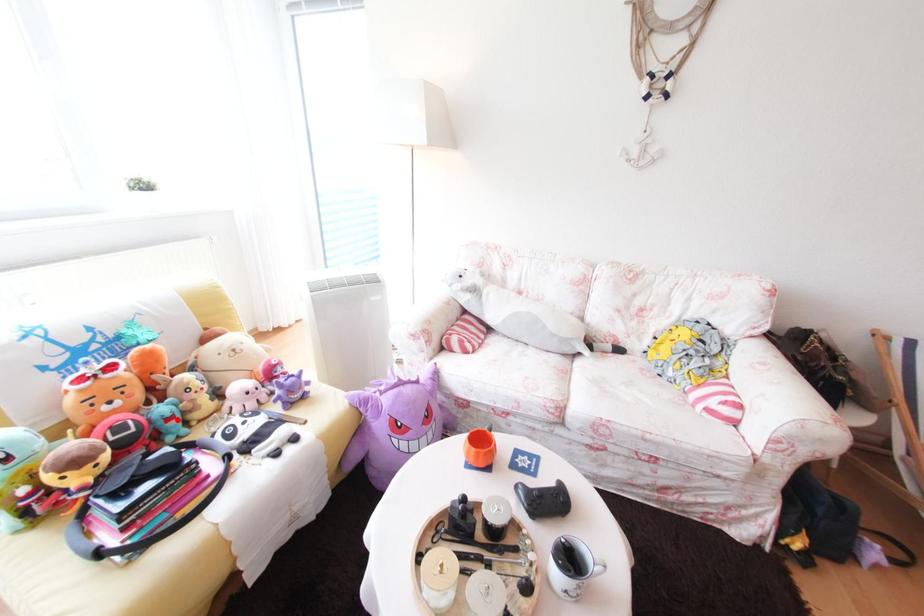
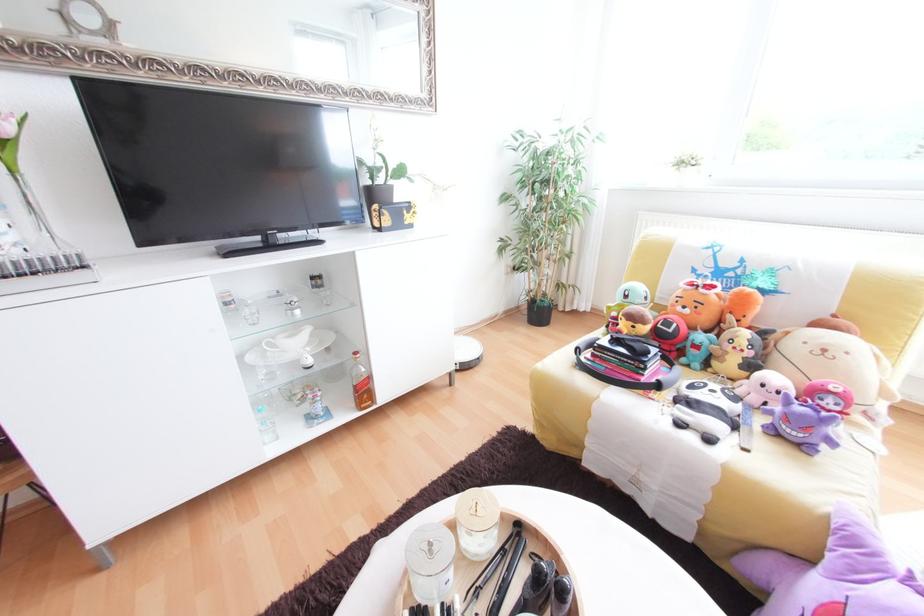
Where in the second image is the point corresponding to the highlighted location from the first image?

(704, 347)